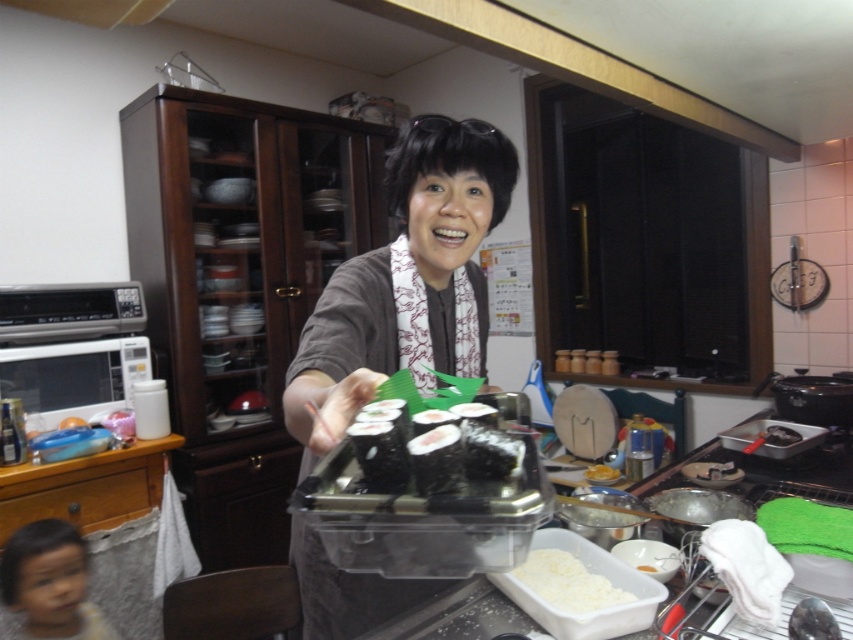
Who is taller, white fluffy rice at lower center or white glossy rice at lower center?

white glossy rice at lower center is taller.

Which is more to the left, white fluffy rice at lower center or white glossy rice at lower center?

white fluffy rice at lower center

You are a GUI agent. You are given a task and a screenshot of the screen. Output one action in this format:
    pyautogui.click(x=<x>, y=<y>)
    Task: Click on the white fluffy rice at lower center
    This screenshot has width=853, height=640.
    Given the screenshot: What is the action you would take?
    pyautogui.click(x=567, y=582)

This screenshot has width=853, height=640. Describe the element at coordinates (405, 282) in the screenshot. I see `matte gray sweater at center` at that location.

Consider the image. Which is more to the left, matte gray sweater at center or black glossy sushi at center?

matte gray sweater at center

Is point (364, 372) more distant than point (767, 428)?

No, (364, 372) is closer to viewer.

Identify the location of matte gray sweater at center. (405, 282).

Is matte gray sweater at center positioned before black seaweed sushi at center?

No, matte gray sweater at center is behind black seaweed sushi at center.

Looking at this image, is matte gray sweater at center above black seaweed sushi at center?

No, matte gray sweater at center is not above black seaweed sushi at center.

Image resolution: width=853 pixels, height=640 pixels. What are the coordinates of `matte gray sweater at center` in the screenshot? It's located at (405, 282).

Identify the location of matte gray sweater at center. This screenshot has width=853, height=640. (405, 282).